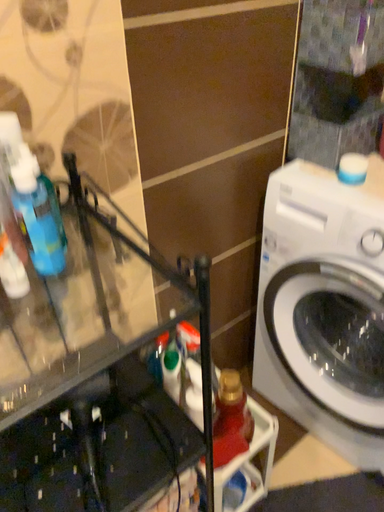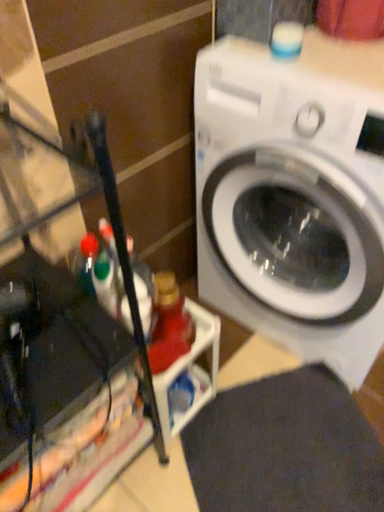
Question: How did the camera likely rotate when shooting the video?

Choices:
 (A) rotated right
 (B) rotated left

Answer: (A)